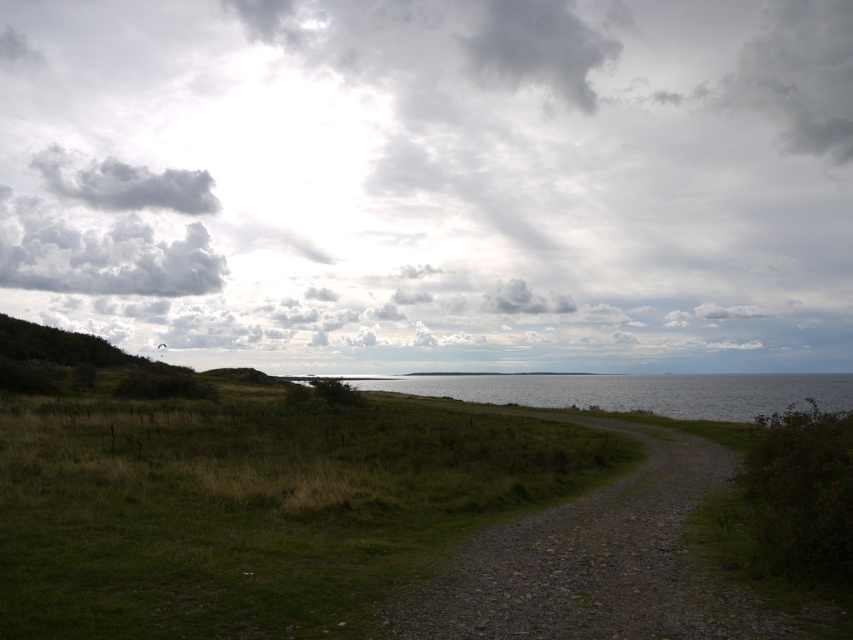
You are a bird soaring above the coastal landscape. You notice the cloudy sky at upper center and the gray fluffy cloud at upper center. Which one is closer to your eyes?

The cloudy sky at upper center is closer to your eyes because it is in front of the gray fluffy cloud at upper center.

You are a hiker who wants to take a photo of the cloudy white cloud at upper left while standing on the dull gray gravel path at center. Which object is narrower in width?

The dull gray gravel path at center is thinner than the cloudy white cloud at upper left, so the path is narrower in width.

You are standing on the gravel path in the foreground and looking up at the cloudy sky at upper center and the gray fluffy cloud at upper center. Which one is closer to your eyes?

The gray fluffy cloud at upper center is closer to your eyes because it is positioned above the cloudy sky at upper center.